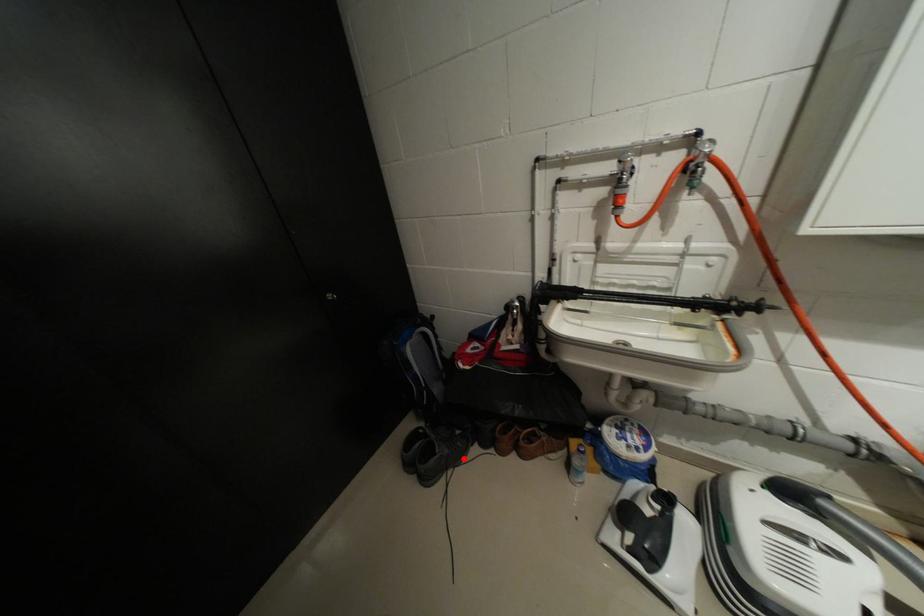
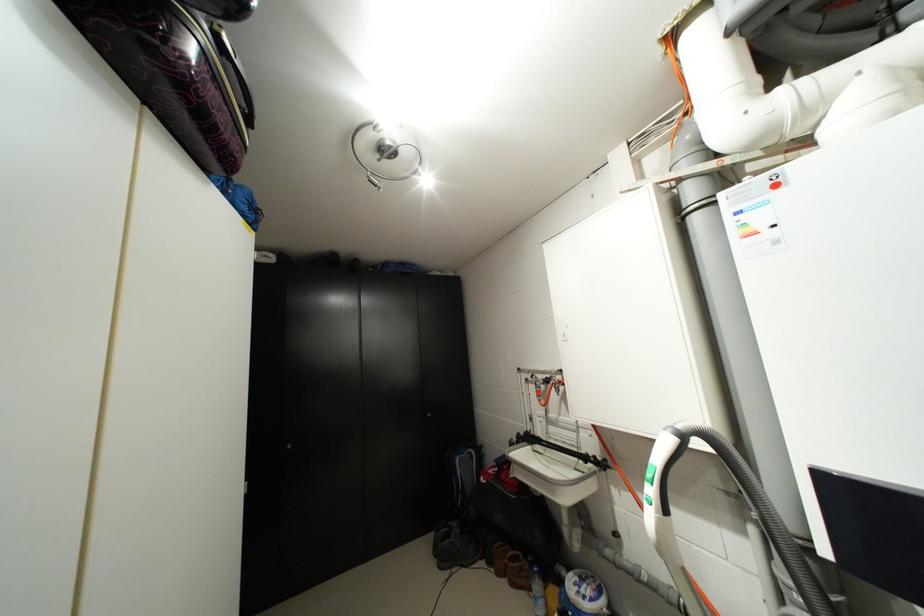
Question: A red point is marked in image1. In image2, is the corresponding 3D point closer to the camera or farther? Reply with the corresponding letter.

Choices:
 (A) The corresponding 3D point is closer.
 (B) The corresponding 3D point is farther.

Answer: (A)